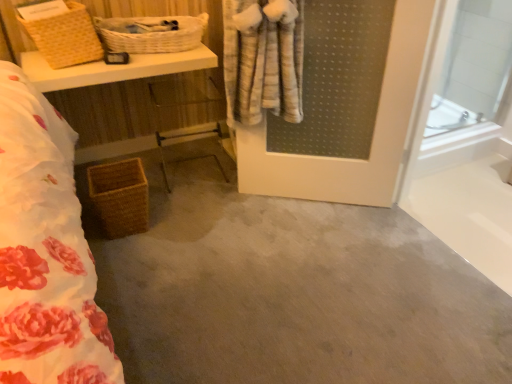
Question: Is the position of gray carpet at center more distant than that of woven brown basket at upper left, acting as the second basket starting from the bottom?

Choices:
 (A) no
 (B) yes

Answer: (A)

Question: Can you confirm if gray carpet at center is shorter than woven brown basket at upper left, acting as the second basket starting from the bottom?

Choices:
 (A) yes
 (B) no

Answer: (A)

Question: Considering the relative positions of gray carpet at center and woven brown basket at upper left, acting as the second basket starting from the bottom, in the image provided, is gray carpet at center in front of woven brown basket at upper left, acting as the second basket starting from the bottom,?

Choices:
 (A) yes
 (B) no

Answer: (A)

Question: Is gray carpet at center at the right side of woven brown basket at upper left, acting as the second basket starting from the bottom?

Choices:
 (A) no
 (B) yes

Answer: (B)

Question: From the image's perspective, would you say gray carpet at center is positioned over woven brown basket at upper left, acting as the second basket starting from the bottom?

Choices:
 (A) yes
 (B) no

Answer: (B)

Question: Does gray carpet at center have a greater height compared to woven brown basket at upper left, acting as the second basket starting from the bottom?

Choices:
 (A) yes
 (B) no

Answer: (B)

Question: Does woven brown basket at lower left, which is counted as the 1th basket, starting from the bottom, have a greater width compared to woven brown basket at upper left, marked as the second basket in a top-to-bottom arrangement?

Choices:
 (A) yes
 (B) no

Answer: (B)

Question: From the image's perspective, is woven brown basket at lower left, the third basket in the top-to-bottom sequence, below woven brown basket at upper left, marked as the second basket in a top-to-bottom arrangement?

Choices:
 (A) yes
 (B) no

Answer: (A)

Question: Can you confirm if woven brown basket at lower left, the third basket in the top-to-bottom sequence, is positioned to the right of woven brown basket at upper left, acting as the second basket starting from the bottom?

Choices:
 (A) yes
 (B) no

Answer: (A)

Question: Is woven brown basket at lower left, the third basket in the top-to-bottom sequence, facing away from woven brown basket at upper left, acting as the second basket starting from the bottom?

Choices:
 (A) yes
 (B) no

Answer: (B)

Question: Does woven brown basket at lower left, which is counted as the 1th basket, starting from the bottom, have a greater height compared to woven brown basket at upper left, marked as the second basket in a top-to-bottom arrangement?

Choices:
 (A) yes
 (B) no

Answer: (B)

Question: Could you tell me if woven brown basket at lower left, the third basket in the top-to-bottom sequence, is turned towards woven brown basket at upper left, marked as the second basket in a top-to-bottom arrangement?

Choices:
 (A) yes
 (B) no

Answer: (B)

Question: Can you confirm if woven brown basket at lower left, the third basket in the top-to-bottom sequence, is wider than woven wicker basket at lower left?

Choices:
 (A) no
 (B) yes

Answer: (A)